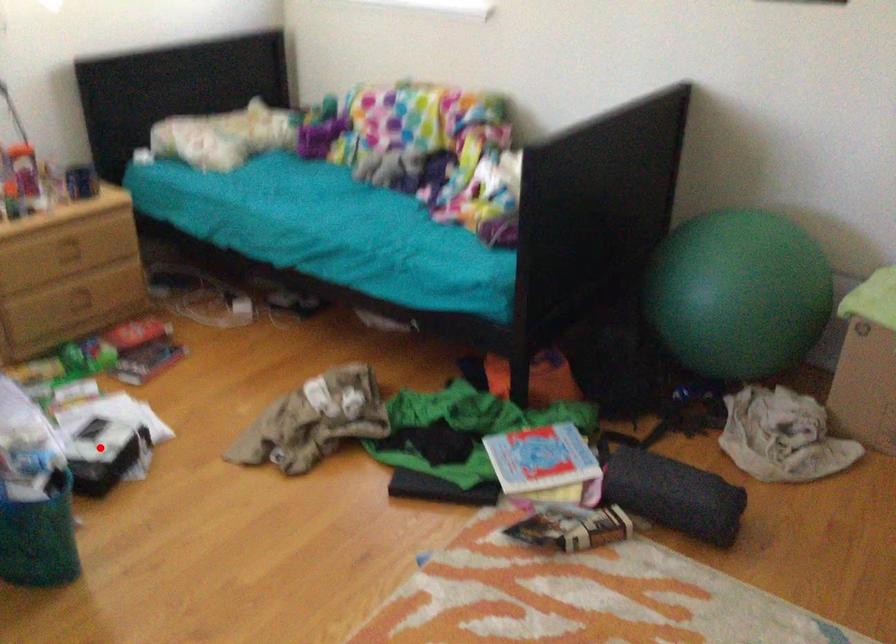
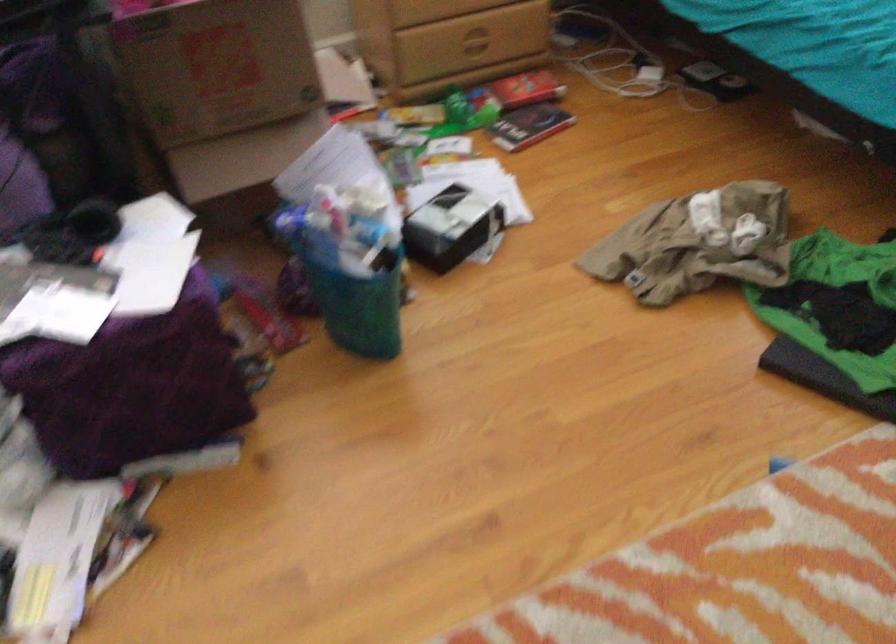
In the second image, find the point that corresponds to the highlighted location in the first image.

(451, 227)